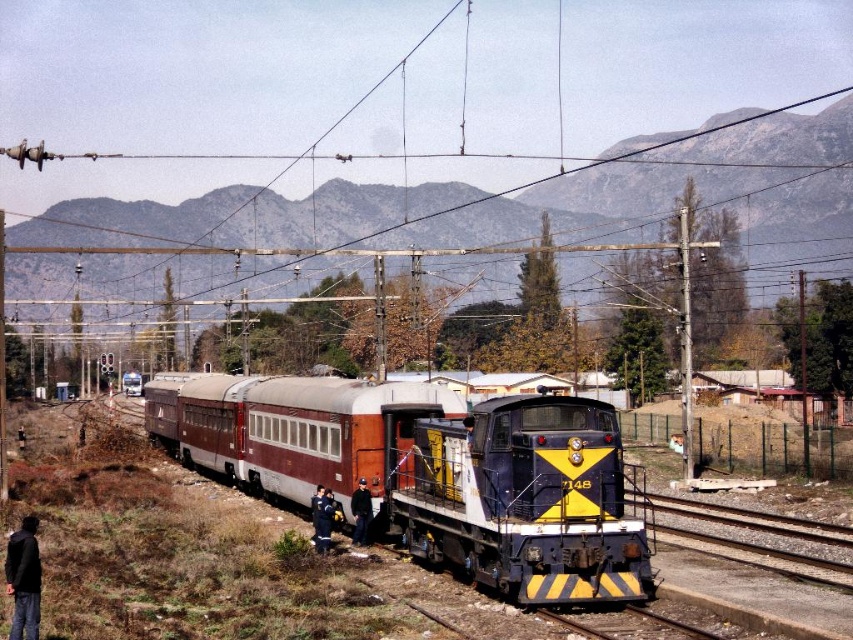
You are a passenger on the train and want to place your black fabric jacket at lower left on the gray gravel train track at lower center. Is the track to the right or left of the jacket?

The gray gravel train track at lower center is positioned on the right side of the black fabric jacket at lower left, so the track is to the right of the jacket.

You are a passenger on the train and want to know where the maroon painted car at center is located in relation to the locomotive. Can you determine its position using coordinates?

The maroon painted car at center is located at coordinates (430, 472), which is behind the locomotive since the locomotive is at the front of the train.